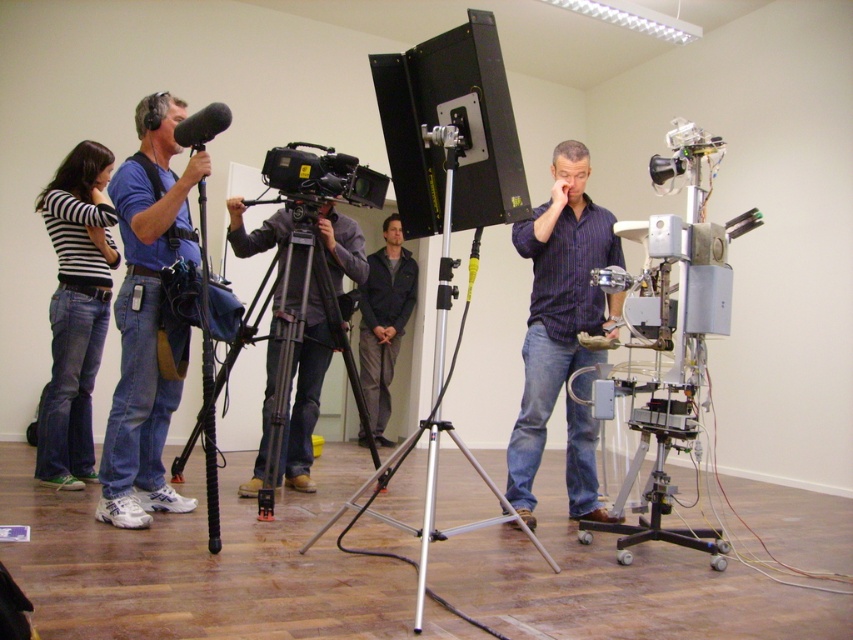
Is blue jeans at left to the right of dark blue jacket at center from the viewer's perspective?

No, blue jeans at left is not to the right of dark blue jacket at center.

Who is lower down, blue jeans at left or dark blue jacket at center?

dark blue jacket at center

This screenshot has height=640, width=853. Describe the element at coordinates (146, 317) in the screenshot. I see `blue jeans at left` at that location.

This screenshot has height=640, width=853. Identify the location of blue jeans at left. (146, 317).

Between dark blue striped shirt at center and black metal tripod at center, which one is positioned lower?

black metal tripod at center is below.

Who is positioned more to the right, dark blue striped shirt at center or black metal tripod at center?

Positioned to the right is dark blue striped shirt at center.

Who is more forward, (566, 252) or (212, 404)?

Point (212, 404) is in front.

Locate an element on the screen. The image size is (853, 640). dark blue striped shirt at center is located at coordinates (558, 307).

Can you confirm if blue jeans at left is shorter than black metal tripod at center?

In fact, blue jeans at left may be taller than black metal tripod at center.

Between point (151, 196) and point (239, 243), which one is positioned behind?

The point (239, 243) is more distant.

Between point (158, 468) and point (309, 264), which one is positioned behind?

The point (309, 264) is more distant.

This screenshot has height=640, width=853. Find the location of `blue jeans at left`. blue jeans at left is located at coordinates coord(146,317).